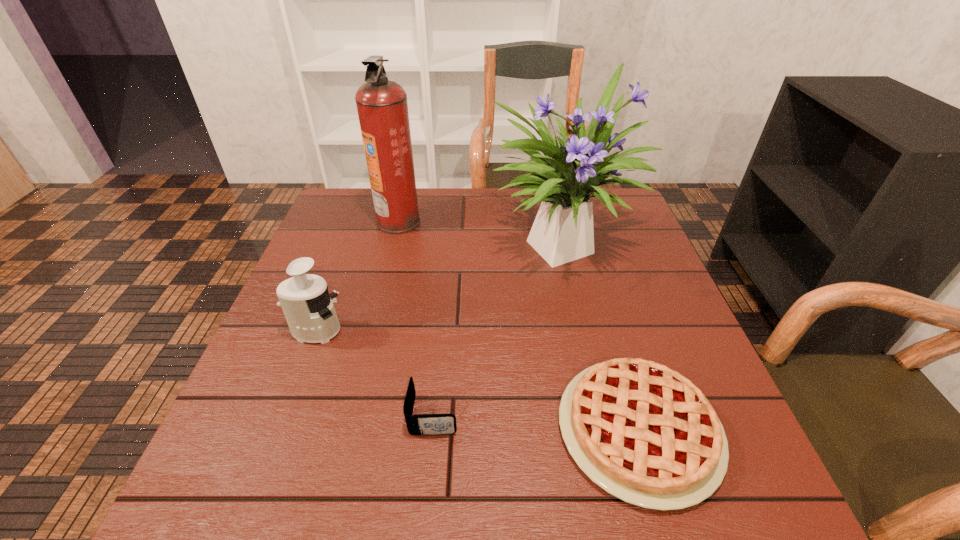
You are a GUI agent. You are given a task and a screenshot of the screen. Output one action in this format:
    pyautogui.click(x=<x>, y=<y>)
    Task: Click on the object that is positioned at the near right corner
    
    Given the screenshot: What is the action you would take?
    click(644, 433)

Identify the location of vacant space at the far edge of the desktop. (444, 213).

You are a GUI agent. You are given a task and a screenshot of the screen. Output one action in this format:
    pyautogui.click(x=<x>, y=<y>)
    Task: Click on the vacant space at the left edge of the desktop
    The width and height of the screenshot is (960, 540).
    Given the screenshot: What is the action you would take?
    pyautogui.click(x=362, y=277)

The width and height of the screenshot is (960, 540). Identify the location of free space at the right edge of the desktop. (625, 254).

Find the location of `free space at the far left corner of the desktop`. free space at the far left corner of the desktop is located at coordinates (326, 225).

Identify the location of free space at the near left corner of the desktop. The height and width of the screenshot is (540, 960). (268, 491).

In the image, there is a desktop. At what (x,y) coordinates should I click in order to perform the action: click on vacant region at the far right corner. Please return your answer as a coordinate pair (x, y). The width and height of the screenshot is (960, 540). Looking at the image, I should click on coord(622,224).

Image resolution: width=960 pixels, height=540 pixels. In order to click on free point between the third farthest object and the shortest object in this screenshot , I will do pos(477,381).

Identify the location of empty location between the fire extinguisher and the flower arrangement. Image resolution: width=960 pixels, height=540 pixels. (482, 232).

Image resolution: width=960 pixels, height=540 pixels. What are the coordinates of `free space between the shortest object and the flower arrangement` in the screenshot? It's located at (602, 335).